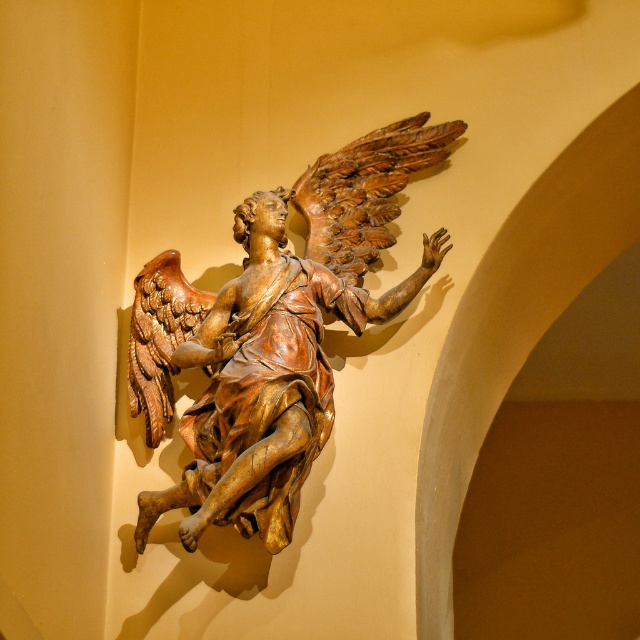
You are an art conservator examining the gold polished wood angel at center. What are the coordinates of its position in the image?

The gold polished wood angel at center is located at coordinates (273, 333).

You are an art conservator assessing the placement of the gold polished wood angel at center and the golden polished wood wing at upper center. Based on their positions, which object is located higher up in the image?

The golden polished wood wing at upper center is located higher up in the image than the gold polished wood angel at center.